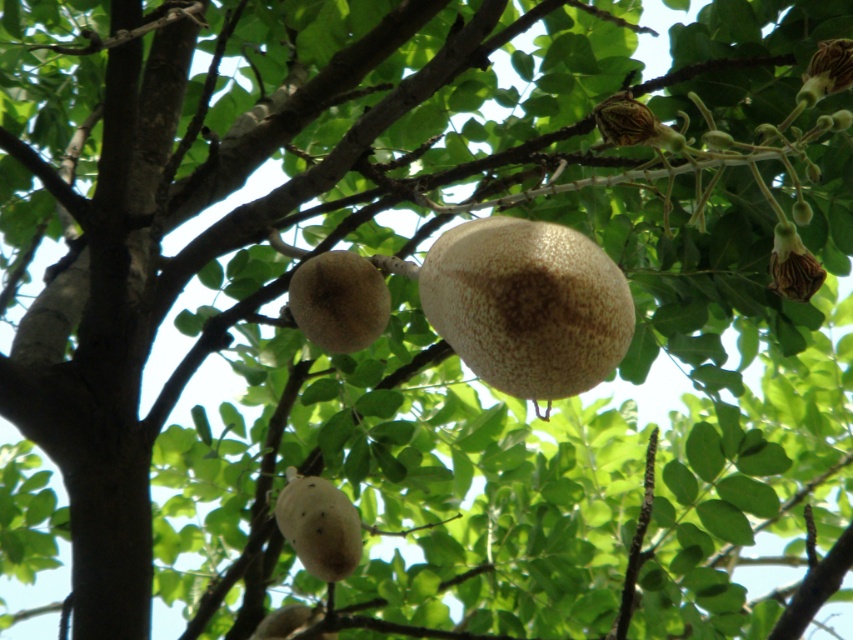
The height and width of the screenshot is (640, 853). I want to click on speckled brown fruit at lower center, so click(x=318, y=525).

Between speckled brown fruit at lower center and brown textured flower at upper right, which one has more height?

Standing taller between the two is speckled brown fruit at lower center.

Find the location of a particular element. speckled brown fruit at lower center is located at coordinates (318, 525).

Does speckled brown fruit at center lie in front of speckled brown fruit at lower center?

Yes.

Who is more forward, (x=427, y=252) or (x=283, y=484)?

Point (x=427, y=252) is more forward.

Find the location of a particular element. speckled brown fruit at center is located at coordinates (527, 305).

Which of these two, speckled beige fruit at center or brown textured flower at upper right, stands shorter?

brown textured flower at upper right

Between speckled beige fruit at center and brown textured flower at upper right, which one appears on the left side from the viewer's perspective?

speckled beige fruit at center

Between point (332, 332) and point (810, 269), which one is positioned in front?

Point (810, 269) is in front.

You are a GUI agent. You are given a task and a screenshot of the screen. Output one action in this format:
    pyautogui.click(x=<x>, y=<y>)
    Task: Click on the speckled beige fruit at center
    The image size is (853, 640).
    Given the screenshot: What is the action you would take?
    pyautogui.click(x=339, y=300)